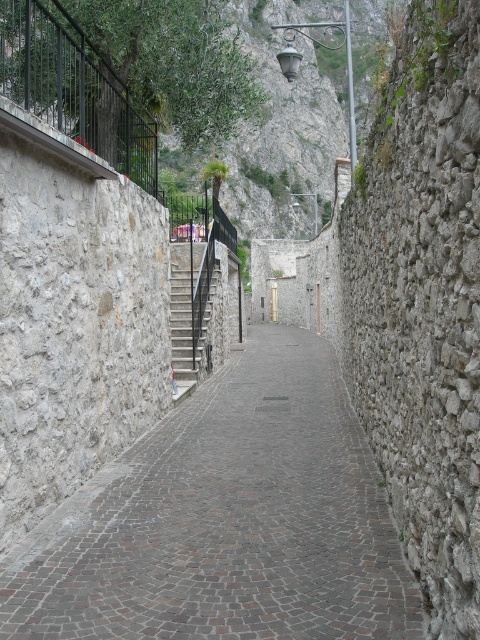
Is brown cobblestone pavement at center further to camera compared to dark gray stone stairs at center?

That is False.

In order to click on brown cobblestone pavement at center in this screenshot , I will do `click(227, 522)`.

Where is `brown cobblestone pavement at center`? Image resolution: width=480 pixels, height=640 pixels. brown cobblestone pavement at center is located at coordinates (227, 522).

Between brown cobblestone pavement at center and black metal railing at upper left, which one is positioned higher?

black metal railing at upper left is higher up.

Between brown cobblestone pavement at center and black metal railing at upper left, which one appears on the right side from the viewer's perspective?

Positioned to the right is brown cobblestone pavement at center.

Is point (312, 620) positioned before point (40, 45)?

Yes, it is.

This screenshot has width=480, height=640. In order to click on brown cobblestone pavement at center in this screenshot , I will do coord(227,522).

Does point (55, 51) come in front of point (196, 374)?

That is True.

Between black metal railing at upper left and dark gray stone stairs at center, which one appears on the left side from the viewer's perspective?

From the viewer's perspective, black metal railing at upper left appears more on the left side.

This screenshot has height=640, width=480. I want to click on black metal railing at upper left, so click(73, 88).